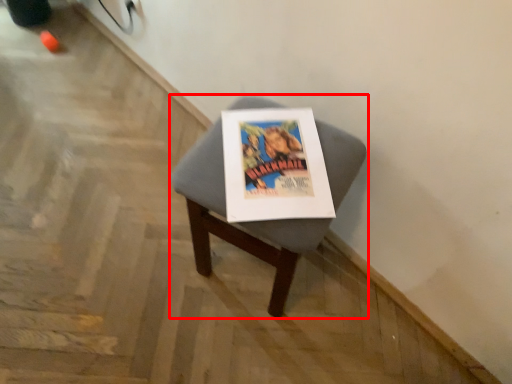
Question: Where is furniture (annotated by the red box) located in relation to magazine in the image?

Choices:
 (A) right
 (B) left

Answer: (B)